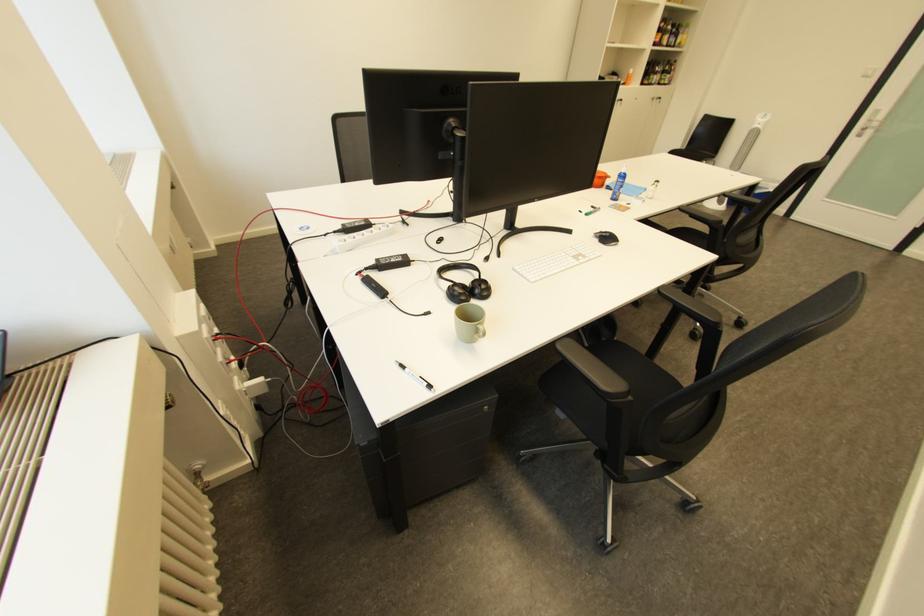
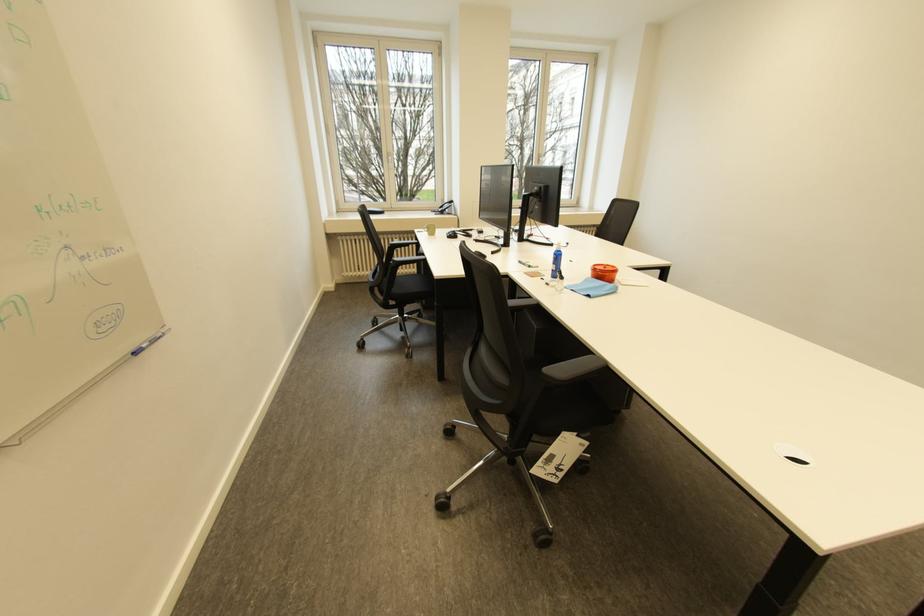
Locate, in the second image, the point that corresponds to (x=496, y=259) in the first image.

(483, 241)